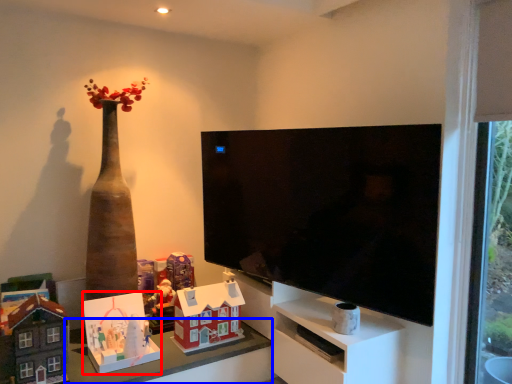
Question: Which of the following is the farthest to the observer, toy (highlighted by a red box) or table (highlighted by a blue box)?

Choices:
 (A) toy
 (B) table

Answer: (A)